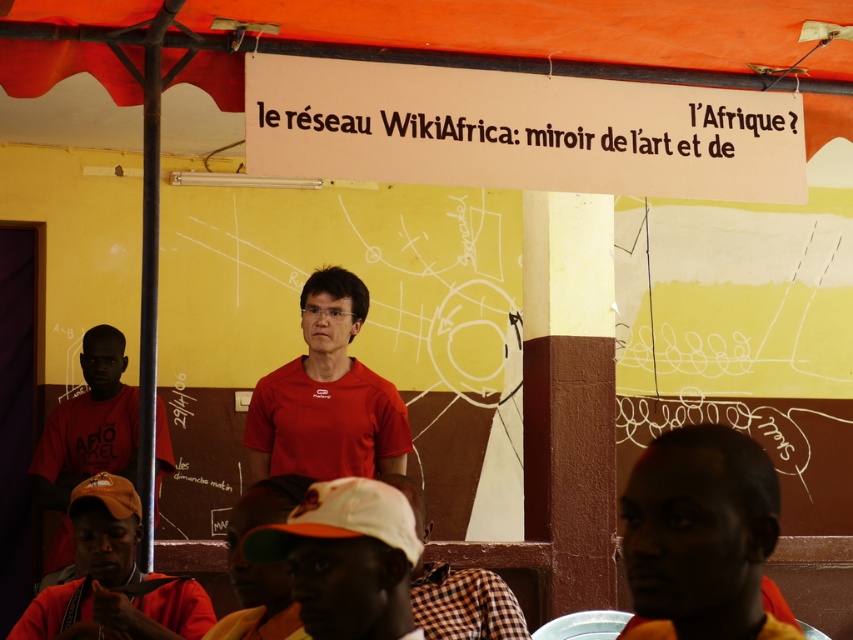
You are an interior designer planning to install a new lighting fixture in this room. You have two orange fabric items available for the job. One is the orange fabric canopy at upper center and the other is the orange fabric cap at lower left. Based on their heights, which item would be more suitable for hanging as a pendant light fixture?

The orange fabric canopy at upper center is not as tall as the orange fabric cap at lower left, so the orange fabric cap at lower left would be more suitable for hanging as a pendant light fixture because it is taller and likely provides better coverage or visibility.

You are an attendee at this event and want to sit between the two people wearing the matte red shirt at center and the matte red shirt at lower left. Is there enough space between them for you to sit comfortably?

The matte red shirt at center is to the right of the matte red shirt at lower left, but the exact distance between them isn not specified. Without knowing the distance, it is uncertain if there is enough space for you to sit comfortably between them.

You are an event organizer at the presentation. You need to arrange a microphone stand between the two people wearing the matte red shirt at center and the matte red shirt at lower left. Based on their heights, which person should the microphone stand be closer to?

The microphone stand should be closer to the matte red shirt at lower left because the matte red shirt at center has a lesser height, so the taller person needs the microphone closer for better reach.